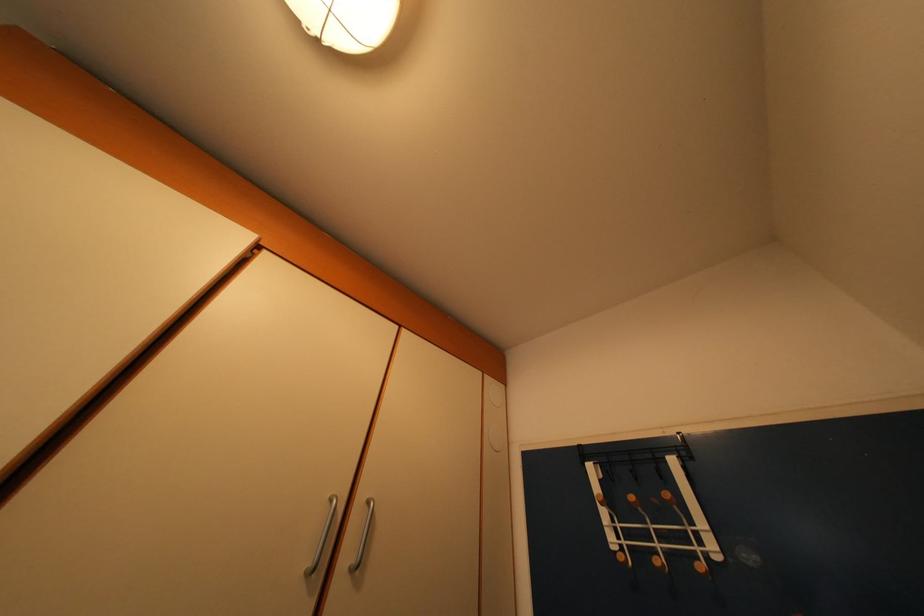
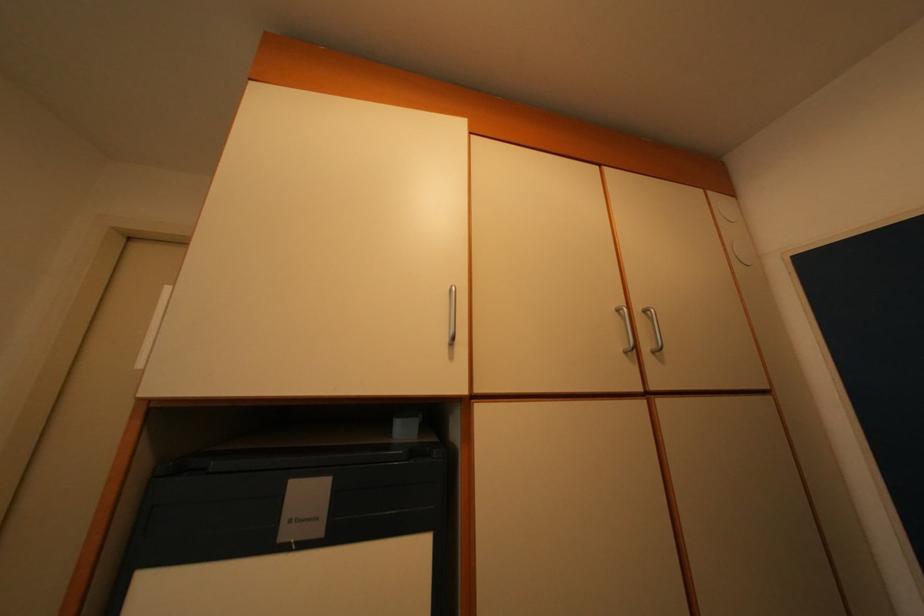
The images are taken continuously from a first-person perspective. In which direction is your viewpoint rotating?

The camera rotated toward left-down.